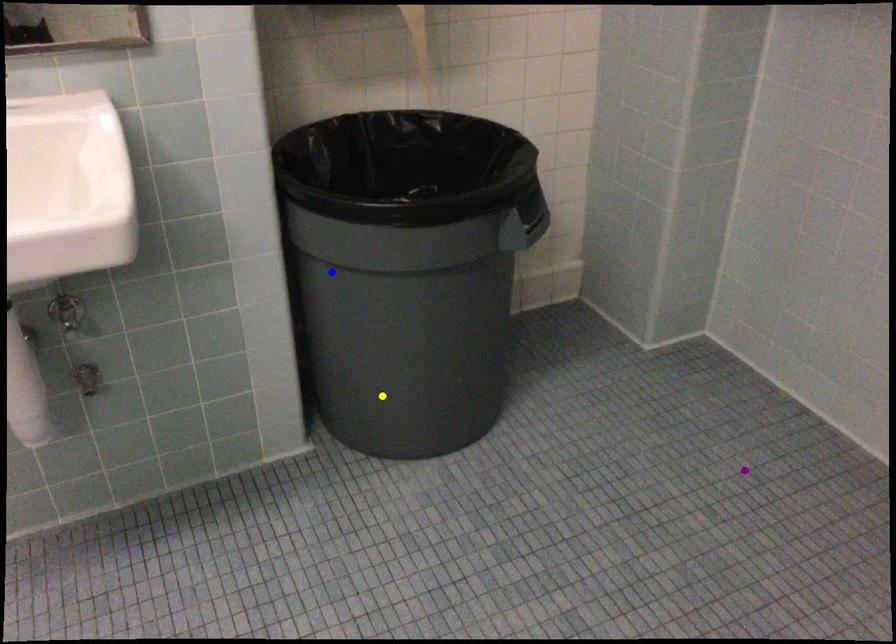
Order these from nearest to farthest:
purple point
blue point
yellow point

1. blue point
2. yellow point
3. purple point